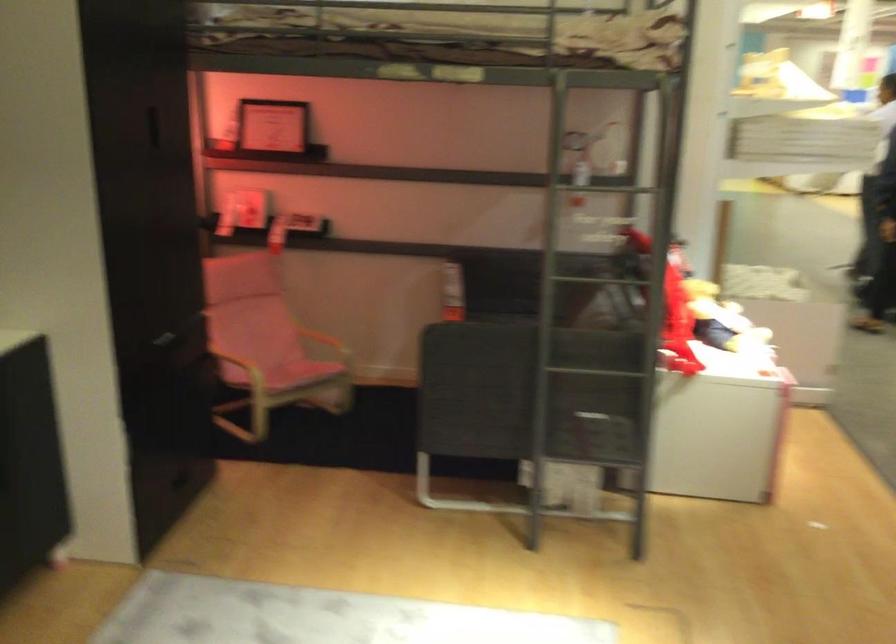
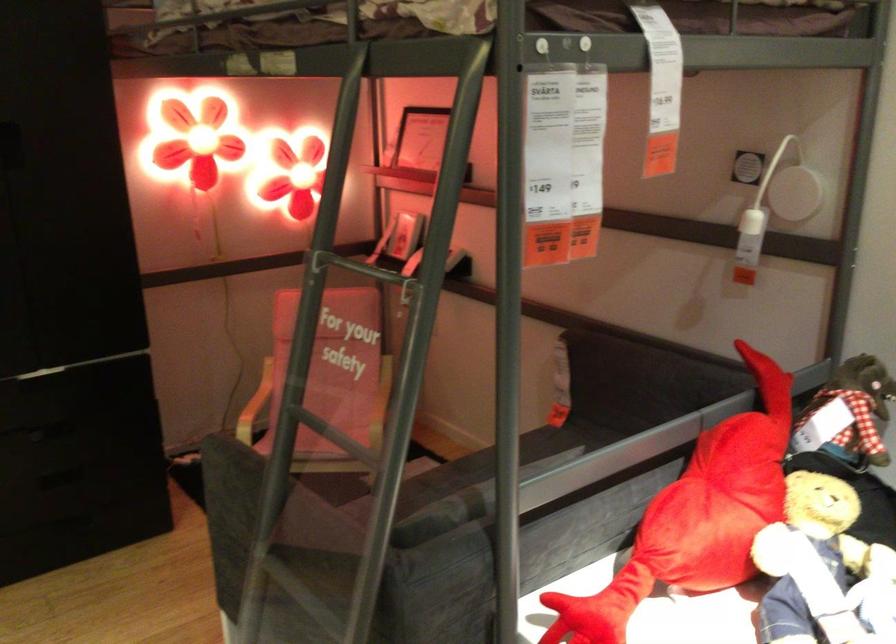
Where in the second image is the point corresponding to point (563, 402) from the first image?

(293, 609)